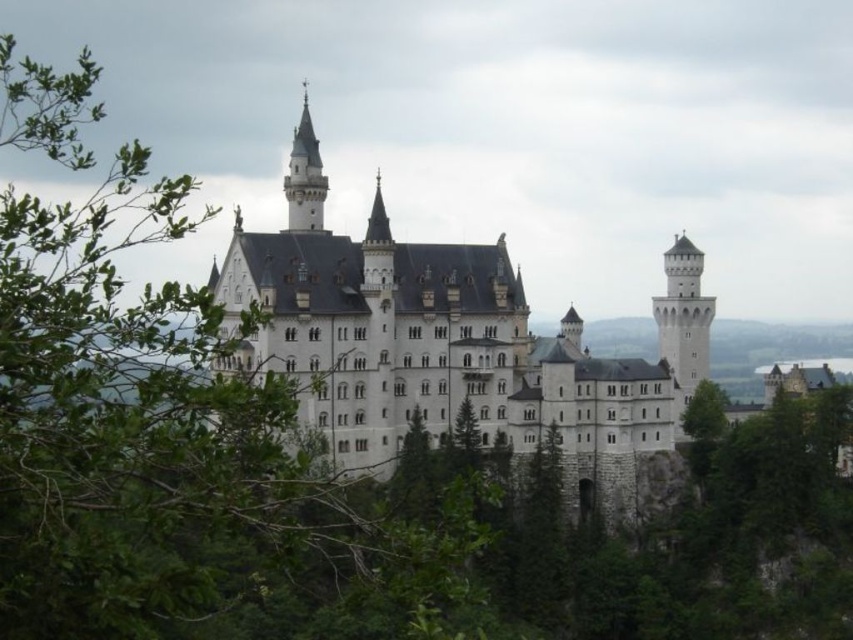
Question: Among these objects, which one is farthest from the camera?

Choices:
 (A) white stone tower at right
 (B) white stone castle at center

Answer: (A)

Question: Can you confirm if green leafy tree at left is positioned to the right of white stone castle at center?

Choices:
 (A) no
 (B) yes

Answer: (A)

Question: Which point is farther to the camera?

Choices:
 (A) (223, 268)
 (B) (689, 308)

Answer: (B)

Question: Estimate the real-world distances between objects in this image. Which object is farther from the green leafy tree at left?

Choices:
 (A) white stone tower at right
 (B) white stone castle at center
 (C) white stone tower at upper center

Answer: (A)

Question: Observing the image, what is the correct spatial positioning of white stone tower at right in reference to white stone tower at upper center?

Choices:
 (A) above
 (B) below

Answer: (B)

Question: Is green leafy tree at left smaller than white stone castle at center?

Choices:
 (A) yes
 (B) no

Answer: (B)